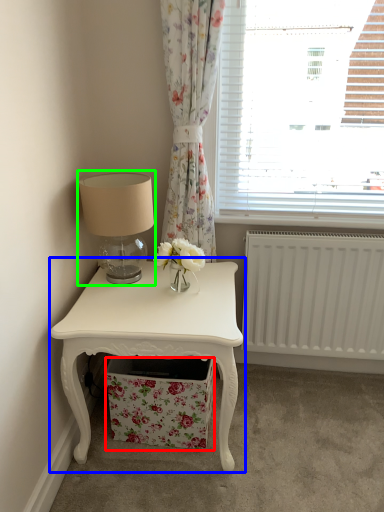
Question: Estimate the real-world distances between objects in this image. Which object is closer to drawer (highlighted by a red box), nightstand (highlighted by a blue box) or table lamp (highlighted by a green box)?

Choices:
 (A) nightstand
 (B) table lamp

Answer: (A)